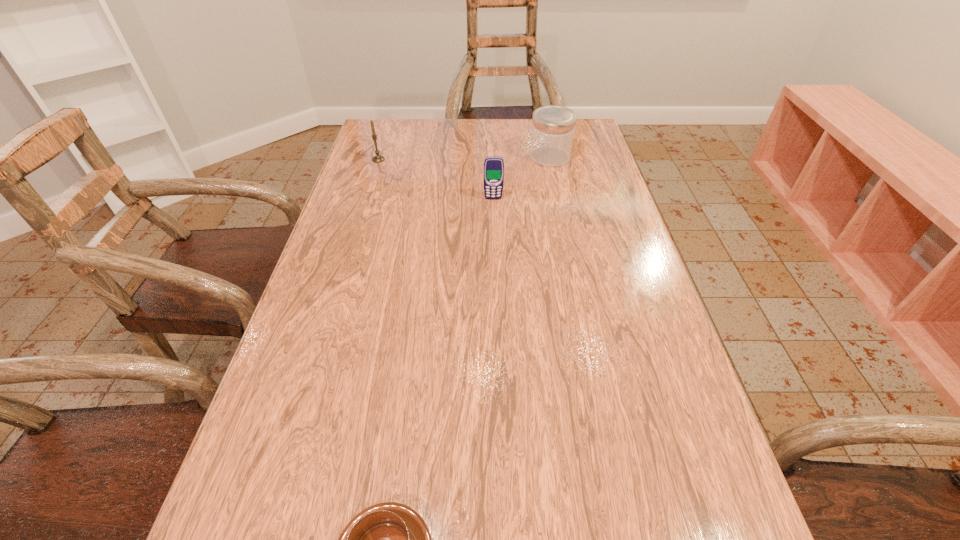
The width and height of the screenshot is (960, 540). Identify the location of jar. (553, 127).

Identify the location of candle. (378, 158).

Locate an element on the screen. The image size is (960, 540). cellular telephone is located at coordinates (493, 166).

This screenshot has height=540, width=960. Identify the location of the second object from right to left. (493, 166).

This screenshot has height=540, width=960. I want to click on blank area located on the back of the jar, so click(544, 132).

Find the location of `vacant space located on the right of the candle`. vacant space located on the right of the candle is located at coordinates (476, 159).

I want to click on vacant region located 0.390m on the front-facing side of the cellular telephone, so click(497, 308).

Where is `object positioned at the far edge`? This screenshot has width=960, height=540. object positioned at the far edge is located at coordinates (553, 127).

Locate an element on the screen. This screenshot has height=540, width=960. object that is at the left edge is located at coordinates (378, 158).

Identify the location of object located in the right edge section of the desktop. (553, 127).